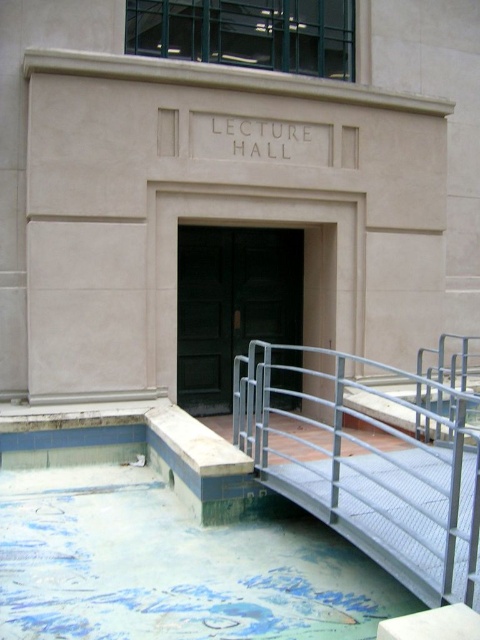
Question: Which object appears farthest from the camera in this image?

Choices:
 (A) green matte door at center
 (B) metal mesh ramp at lower center

Answer: (A)

Question: Does metal mesh ramp at lower center have a larger size compared to green matte door at center?

Choices:
 (A) yes
 (B) no

Answer: (A)

Question: From the image, what is the correct spatial relationship of metal mesh ramp at lower center in relation to green matte door at center?

Choices:
 (A) left
 (B) right

Answer: (B)

Question: Can you confirm if metal mesh ramp at lower center is positioned to the left of green matte door at center?

Choices:
 (A) no
 (B) yes

Answer: (A)